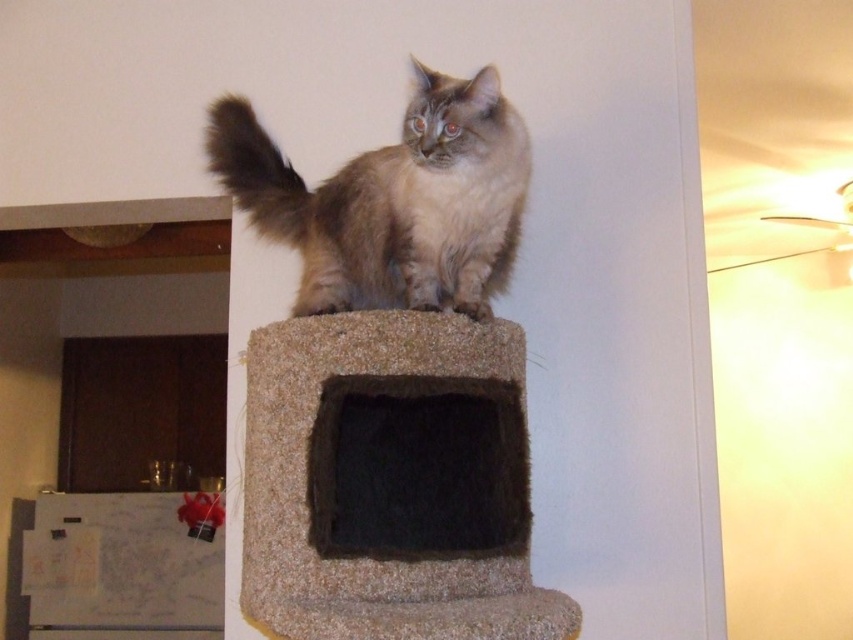
Question: Is fuzzy beige cat at center smaller than fuzzy brown tail at upper center?

Choices:
 (A) no
 (B) yes

Answer: (A)

Question: Which point is farther from the camera taking this photo?

Choices:
 (A) (286, 209)
 (B) (418, 80)

Answer: (A)

Question: Does fuzzy beige cat at center appear on the right side of fuzzy brown tail at upper center?

Choices:
 (A) no
 (B) yes

Answer: (B)

Question: Does fuzzy beige cat at center appear under fuzzy brown tail at upper center?

Choices:
 (A) yes
 (B) no

Answer: (A)

Question: Among these objects, which one is nearest to the camera?

Choices:
 (A) fuzzy brown tail at upper center
 (B) fuzzy beige cat at center

Answer: (B)